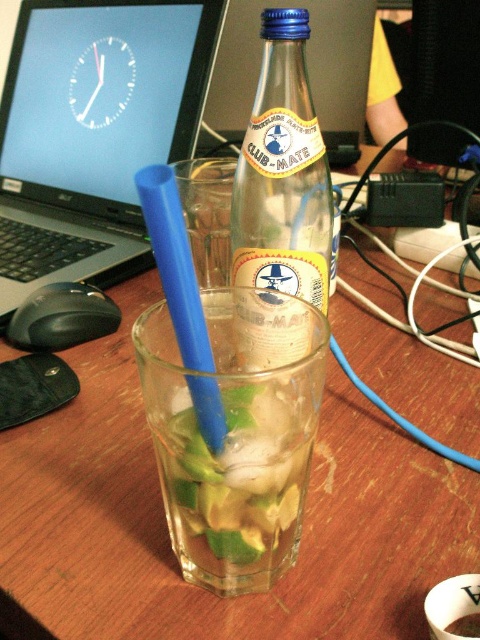
Is black plastic laptop at upper left to the right of blue plastic straw at center from the viewer's perspective?

Incorrect, black plastic laptop at upper left is not on the right side of blue plastic straw at center.

Is black plastic laptop at upper left wider than blue plastic straw at center?

Yes.

The width and height of the screenshot is (480, 640). What do you see at coordinates (94, 131) in the screenshot? I see `black plastic laptop at upper left` at bounding box center [94, 131].

Locate an element on the screen. This screenshot has width=480, height=640. black plastic laptop at upper left is located at coordinates (94, 131).

Which is more to the left, black plastic laptop at upper left or clear glass bottle at center?

black plastic laptop at upper left

Between black plastic laptop at upper left and clear glass bottle at center, which one is positioned higher?

black plastic laptop at upper left

What are the coordinates of `black plastic laptop at upper left` in the screenshot? It's located at (94, 131).

Where is `black plastic laptop at upper left`? The height and width of the screenshot is (640, 480). black plastic laptop at upper left is located at coordinates (94, 131).

Can you confirm if clear glass bottle at center is positioned above blue plastic straw at center?

Yes, clear glass bottle at center is above blue plastic straw at center.

Which is above, clear glass bottle at center or blue plastic straw at center?

clear glass bottle at center is higher up.

Where is `clear glass bottle at center`? clear glass bottle at center is located at coordinates (283, 173).